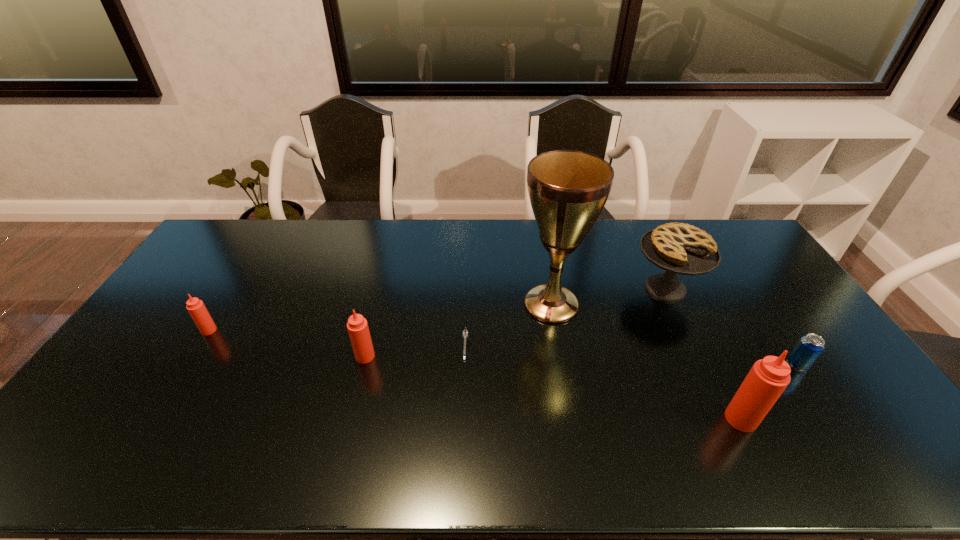
If we want them evenly spaced by inserting an extra Tabasco_sauce among them, please locate a free spot for this new Tabasco_sauce. Please provide its 2D coordinates. Your answer should be formatted as a tuple, i.e. [(x, y)], where the tuple contains the x and y coordinates of a point satisfying the conditions above.

[(541, 386)]